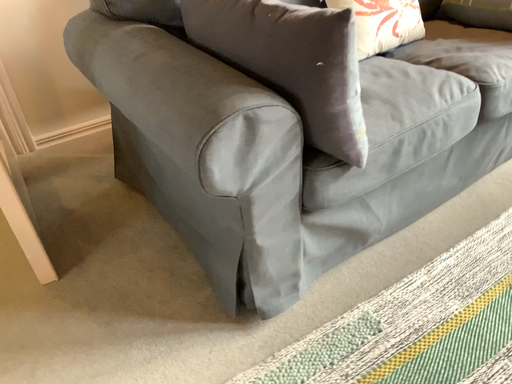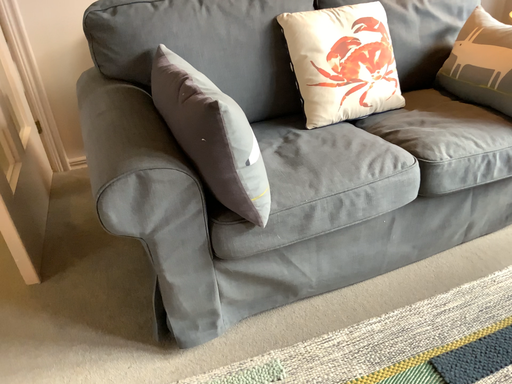
Question: How did the camera likely rotate when shooting the video?

Choices:
 (A) rotated right
 (B) rotated left

Answer: (B)